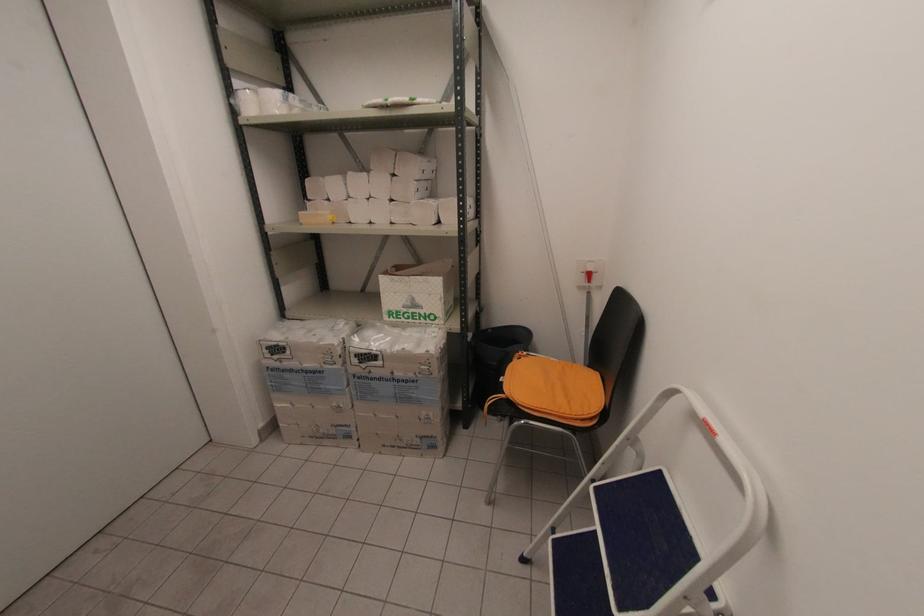
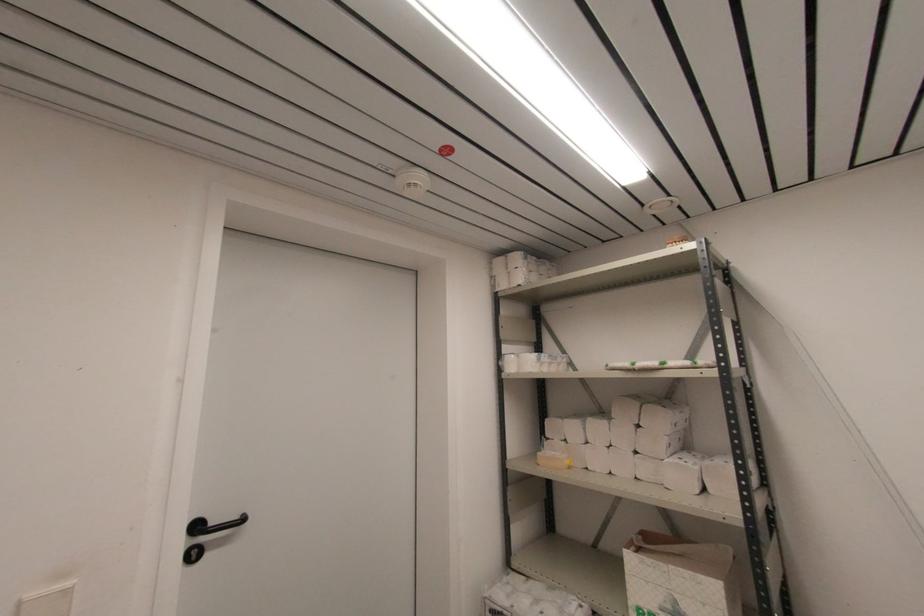
The point at [410,304] is marked in the first image. Where is the corresponding point in the second image?

(671, 609)